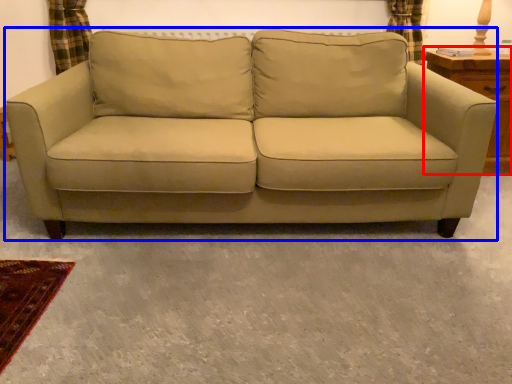
Question: Which object is closer to the camera taking this photo, dresser (highlighted by a red box) or studio couch (highlighted by a blue box)?

Choices:
 (A) dresser
 (B) studio couch

Answer: (B)